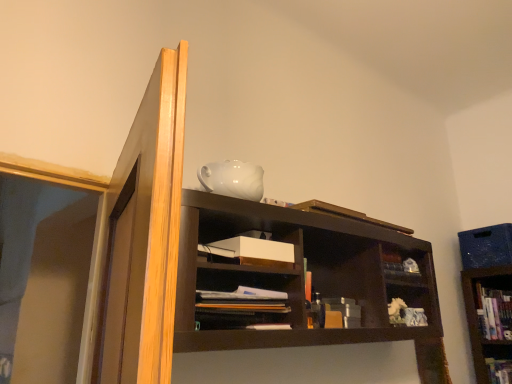
Question: Is matte brown books at center oriented away from white matte paper at center?

Choices:
 (A) yes
 (B) no

Answer: (B)

Question: Can you confirm if matte brown books at center is smaller than white matte paper at center?

Choices:
 (A) no
 (B) yes

Answer: (A)

Question: From the image's perspective, is matte brown books at center over white matte paper at center?

Choices:
 (A) yes
 (B) no

Answer: (B)

Question: Is matte brown books at center positioned beyond the bounds of white matte paper at center?

Choices:
 (A) no
 (B) yes

Answer: (B)

Question: Would you consider matte brown books at center to be distant from white matte paper at center?

Choices:
 (A) yes
 (B) no

Answer: (B)

Question: From a real-world perspective, does matte brown books at center sit lower than white matte paper at center?

Choices:
 (A) yes
 (B) no

Answer: (A)

Question: Is white matte paper at center thinner than matte brown books at center?

Choices:
 (A) no
 (B) yes

Answer: (B)

Question: From the image's perspective, is white matte paper at center located above matte brown books at center?

Choices:
 (A) no
 (B) yes

Answer: (B)

Question: Does white matte paper at center come in front of matte brown books at center?

Choices:
 (A) no
 (B) yes

Answer: (A)

Question: Can you confirm if white matte paper at center is bigger than matte brown books at center?

Choices:
 (A) no
 (B) yes

Answer: (A)

Question: Is white matte paper at center not inside matte brown books at center?

Choices:
 (A) yes
 (B) no

Answer: (A)

Question: Considering the relative positions of white matte paper at center and matte brown books at center in the image provided, is white matte paper at center behind matte brown books at center?

Choices:
 (A) yes
 (B) no

Answer: (A)

Question: Considering the relative sizes of matte brown books at center and hardcover book at upper right, positioned as the 3th book in front-to-back order, in the image provided, is matte brown books at center smaller than hardcover book at upper right, positioned as the 3th book in front-to-back order,?

Choices:
 (A) yes
 (B) no

Answer: (A)